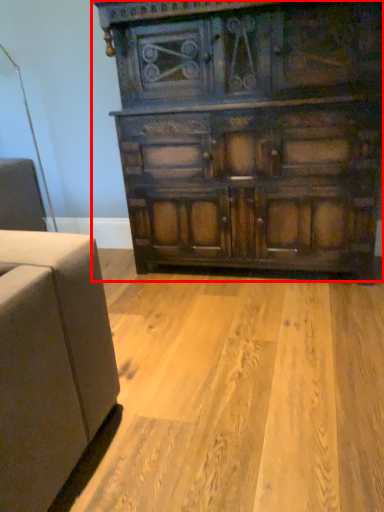
Question: From the image's perspective, what is the correct spatial relationship of chest of drawers (annotated by the red box) in relation to plywood?

Choices:
 (A) above
 (B) below

Answer: (A)